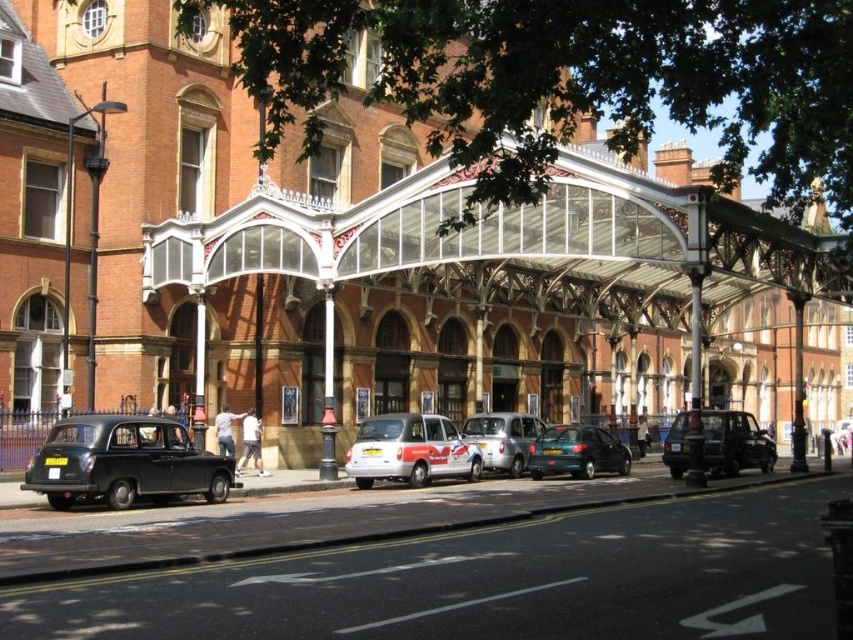
Looking at this image, you are a pedestrian standing on the sidewalk near the entrance of the Victorian building. You see a white glossy taxi at center and a silver metallic car at center. Which vehicle is blocking the other one from moving forward?

The white glossy taxi at center is positioned over silver metallic car at center, meaning it is blocking the silver metallic car at center from moving forward.

You are a pedestrian standing on the sidewalk near the entrance of the Victorian building. You need to cross the street to reach the other side. There are two vehicles parked here, the matte black taxi at lower left and the silver metallic car at center. Which vehicle should you use as a reference point to ensure you cross safely between them?

You should use the matte black taxi at lower left as a reference point because it is positioned to the left of the silver metallic car at center, so crossing between them would be safer.